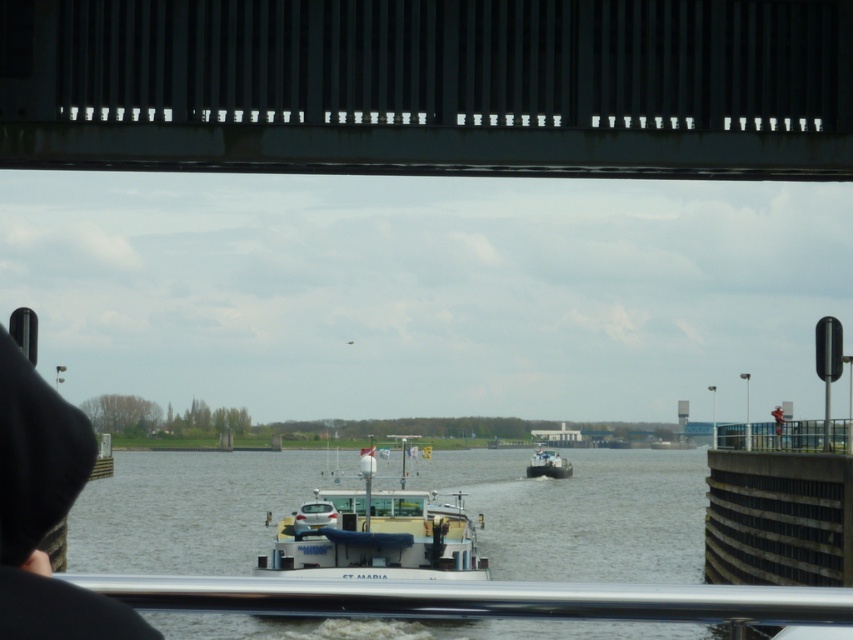
Question: Does silver metallic rail at lower center appear over white matte boat at center?

Choices:
 (A) no
 (B) yes

Answer: (B)

Question: Which object is closer to the camera taking this photo?

Choices:
 (A) white matte boat at center
 (B) smooth concrete bridge at upper center

Answer: (B)

Question: Which object is the closest to the white matte barge at center?

Choices:
 (A) white matte boat at center
 (B) smooth concrete bridge at upper center

Answer: (B)

Question: Is smooth concrete bridge at upper center behind white matte barge at center?

Choices:
 (A) no
 (B) yes

Answer: (A)

Question: Does silver metallic rail at lower center appear on the left side of white matte barge at center?

Choices:
 (A) no
 (B) yes

Answer: (A)

Question: Among these objects, which one is farthest from the camera?

Choices:
 (A) smooth concrete bridge at upper center
 (B) white matte barge at center

Answer: (B)